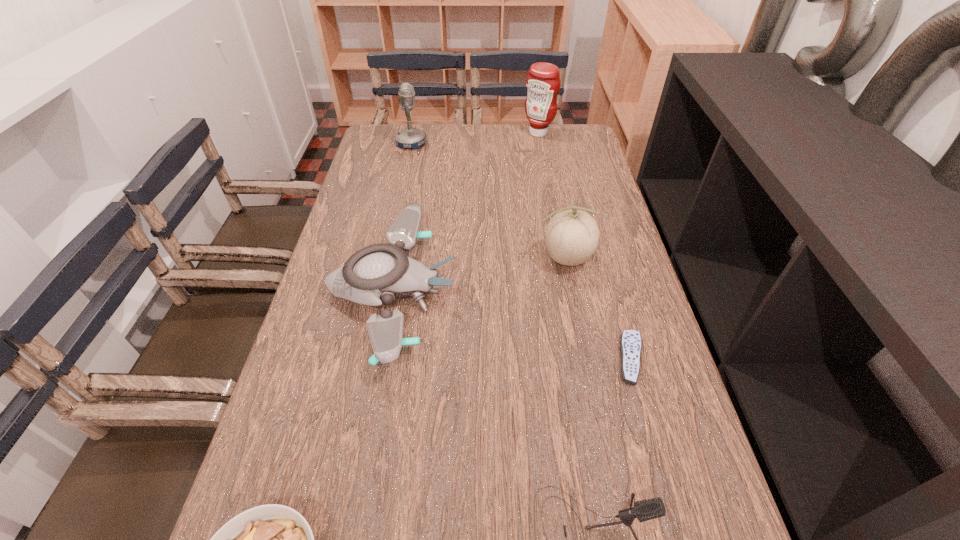
Where is `free space at the far edge`? The height and width of the screenshot is (540, 960). free space at the far edge is located at coordinates (421, 130).

The image size is (960, 540). In the image, there is a desktop. Identify the location of vacant space at the left edge. (347, 306).

In the image, there is a desktop. Where is `vacant space at the right edge`? Image resolution: width=960 pixels, height=540 pixels. vacant space at the right edge is located at coordinates (636, 320).

In order to click on free region at the far left corner of the desktop in this screenshot , I will do `click(378, 140)`.

Identify the location of free spot between the cantaloup and the left microphone. (489, 201).

This screenshot has width=960, height=540. What are the coordinates of `free spot between the condiment and the cantaloup` in the screenshot? It's located at (552, 195).

This screenshot has height=540, width=960. What are the coordinates of `vacant space that is in between the condiment and the left microphone` in the screenshot? It's located at (475, 138).

Where is `free space between the taller microphone and the condiment`? The image size is (960, 540). free space between the taller microphone and the condiment is located at coordinates (475, 138).

The image size is (960, 540). In order to click on unoccupied area between the shortest object and the drone in this screenshot , I will do `click(512, 325)`.

Where is `vacant space in between the remote control and the drone`? The height and width of the screenshot is (540, 960). vacant space in between the remote control and the drone is located at coordinates (512, 325).